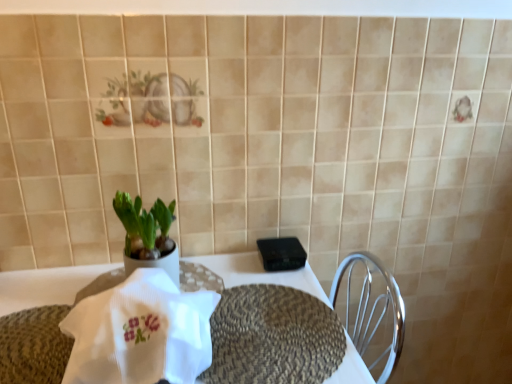
At what (x,y) coordinates should I click in order to perform the action: click on blank space to the left of green matte plant at center. Please return your answer as a coordinate pair (x, y). This screenshot has width=512, height=384. Looking at the image, I should click on (75, 284).